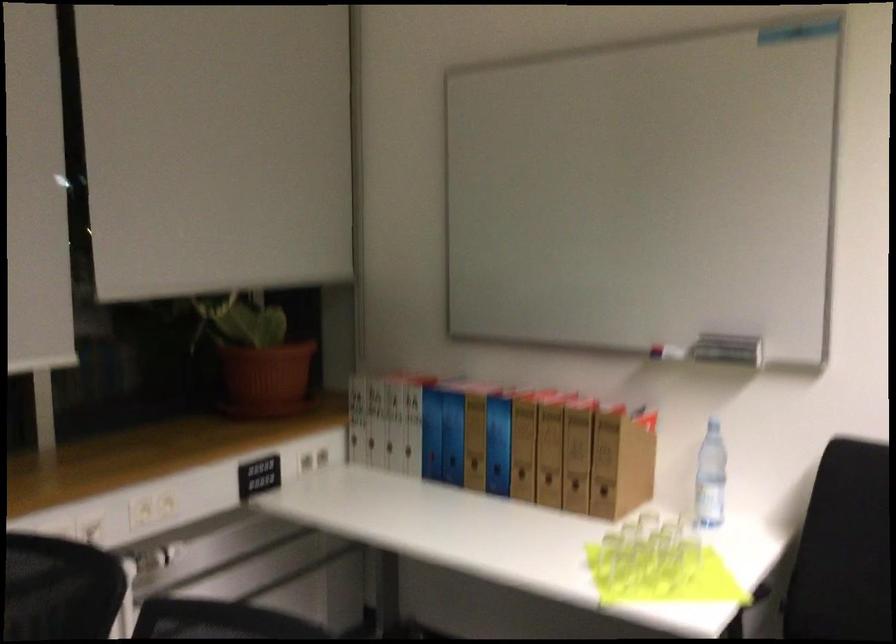
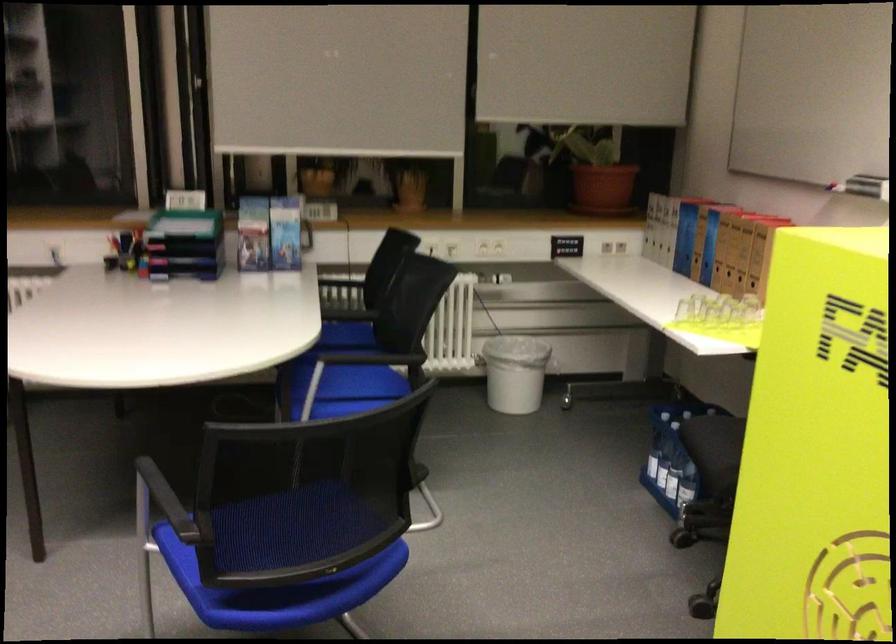
Where in the second image is the point corresponding to [283,384] from the first image?

(602, 187)